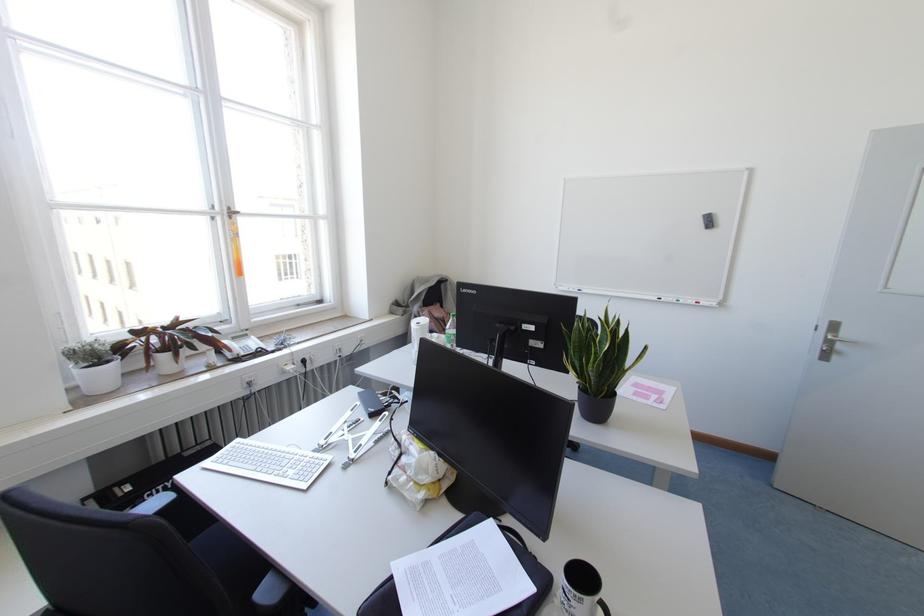
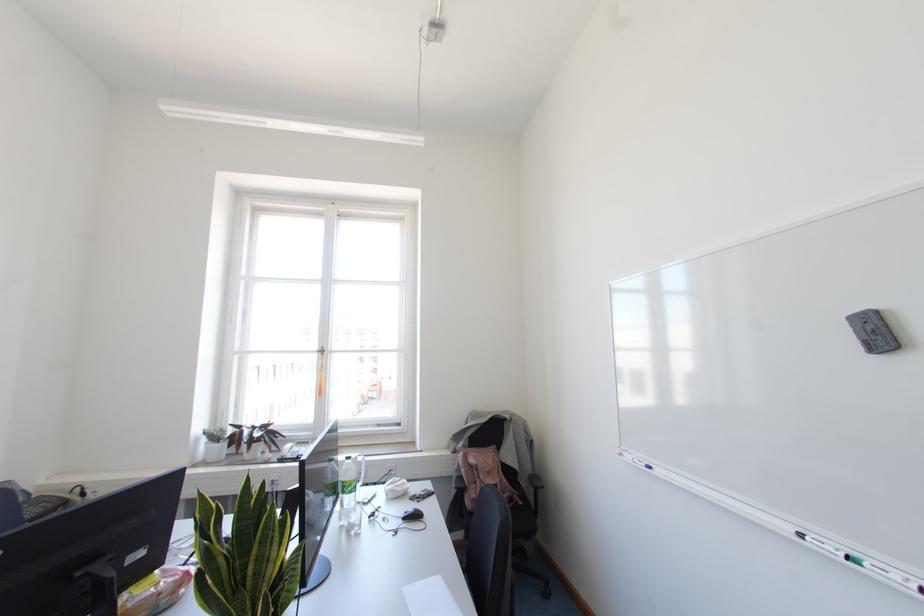
Where in the second image is the point corresponding to point 229,217 from the first image?

(322, 353)